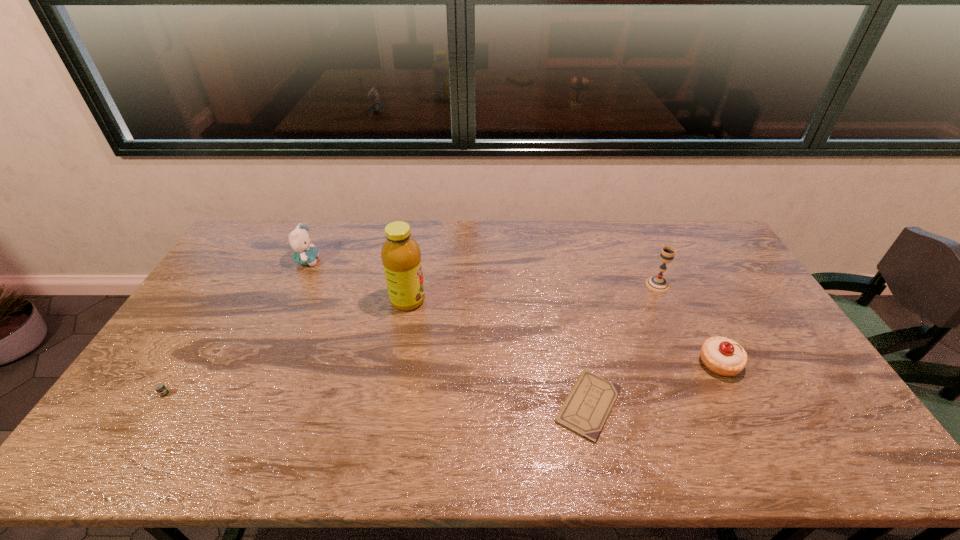
Where is `vacant space located 0.190m on the front label of the fourth object from right to left`? The height and width of the screenshot is (540, 960). vacant space located 0.190m on the front label of the fourth object from right to left is located at coordinates point(485,300).

You are a GUI agent. You are given a task and a screenshot of the screen. Output one action in this format:
    pyautogui.click(x=<x>, y=<y>)
    Task: Click on the free space located 0.180m on the left of the chalice
    This screenshot has height=540, width=960.
    Given the screenshot: What is the action you would take?
    pyautogui.click(x=592, y=285)

In order to click on free spot located 0.050m on the face of the farthest object in this screenshot , I will do `click(333, 261)`.

Image resolution: width=960 pixels, height=540 pixels. Find the location of `free location located 0.070m on the back of the pastry`. free location located 0.070m on the back of the pastry is located at coordinates (702, 329).

This screenshot has width=960, height=540. Identify the location of blank space located 0.390m on the back of the leftmost object. (229, 291).

Where is `vacant area situated 0.360m on the left of the fourth object from left to right`? The width and height of the screenshot is (960, 540). vacant area situated 0.360m on the left of the fourth object from left to right is located at coordinates (412, 406).

Identify the location of object situated at the far edge. (299, 239).

Find the location of a particular element. The image size is (960, 540). object located in the near edge section of the desktop is located at coordinates (588, 405).

At what (x,y) coordinates should I click in order to perform the action: click on object that is positioned at the left edge. Please return your answer as a coordinate pair (x, y). This screenshot has height=540, width=960. Looking at the image, I should click on (160, 388).

This screenshot has height=540, width=960. What are the coordinates of `free space at the far edge of the desktop` in the screenshot? It's located at (567, 234).